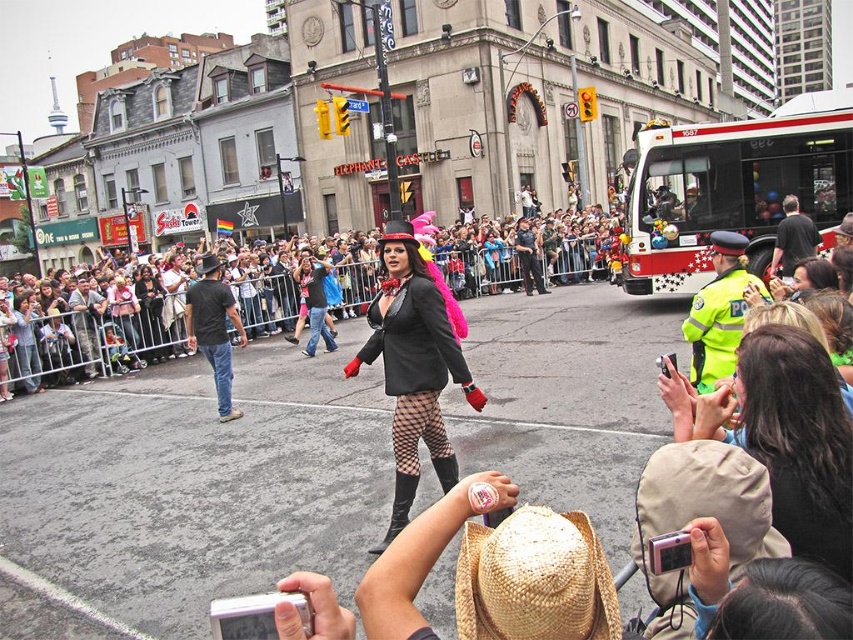
You are a photographer trying to capture both the matte black jacket at center and the straw hat at lower center in a single frame. Given their sizes, which object should you zoom in on to ensure both are visible without cropping?

Since the matte black jacket at center is wider than the straw hat at lower center, you should zoom in on the matte black jacket at center to ensure both objects fit within the frame.

Looking at this image, you are a photographer trying to capture both the white plastic bus at right and the straw hat at lower center in a single shot. Based on their sizes, which object should you focus on to ensure both are visible in the frame?

Since the white plastic bus at right is larger than the straw hat at lower center, you should focus on the white plastic bus at right to ensure both are visible in the frame.